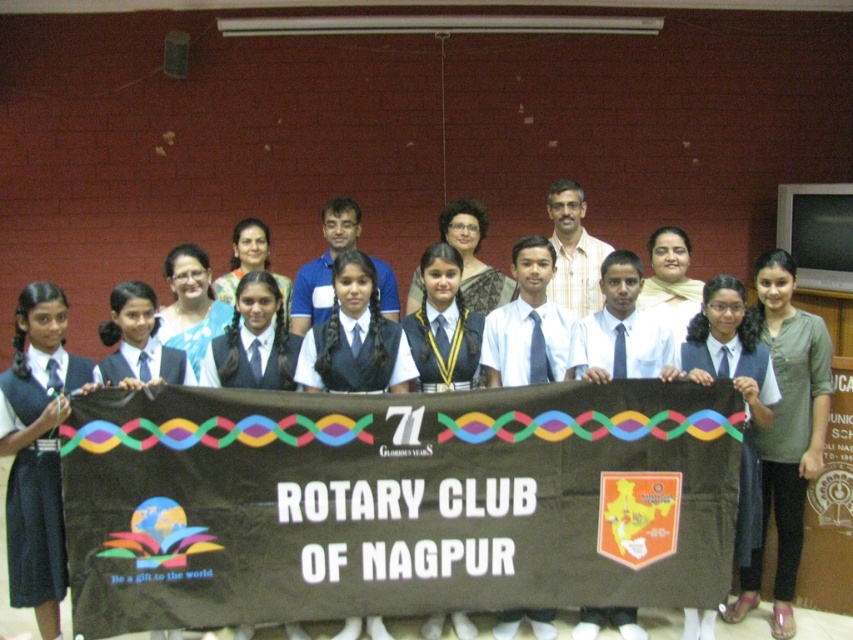
Where is the matte black tie at left located in the image?

The matte black tie at left is located at point (38, 449) in the image.

You are a photographer setting up for a group photo. You notice the brown fabric banner at center and the matte black tie at left. Which object is shorter in height?

The brown fabric banner at center is shorter in height than the matte black tie at left.